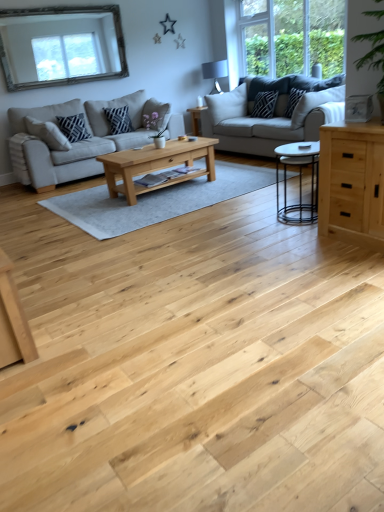
The image size is (384, 512). I want to click on unoccupied area in front of natural wood chest of drawers at right, so click(357, 264).